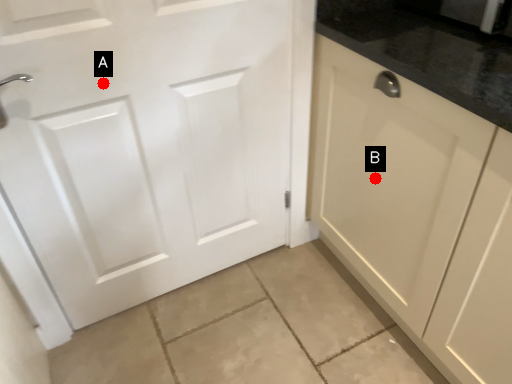
Question: Two points are circled on the image, labeled by A and B beside each circle. Which of the following is the closest to the observer?

Choices:
 (A) A is closer
 (B) B is closer

Answer: (A)